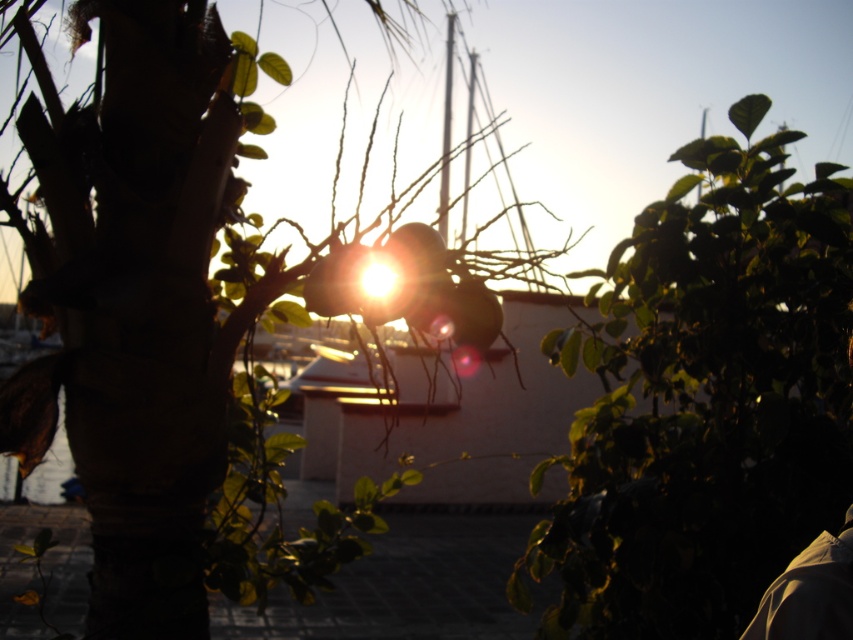
You are standing in the scene and want to walk from the green leafy tree at center to the green leafy plant at upper right. Which direction should you move?

You should move to the right since the green leafy tree at center is to the left of the green leafy plant at upper right.

You are an observer standing in the middle of the scene. You see the green leafy tree at center and the green leafy plant at upper right. Which one appears larger in size?

The green leafy plant at upper right is larger than the green leafy tree at center.

You are standing in the middle of the scene and want to walk towards the green leafy tree at center. Which direction should you head?

The green leafy tree at center is located at point (141, 304), so you should head towards the lower center direction to reach it.